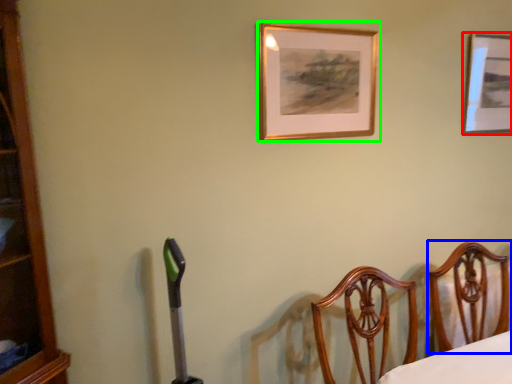
Question: Considering the real-world distances, which object is farthest from picture frame (highlighted by a red box)? furniture (highlighted by a blue box) or picture frame (highlighted by a green box)?

Choices:
 (A) furniture
 (B) picture frame

Answer: (A)